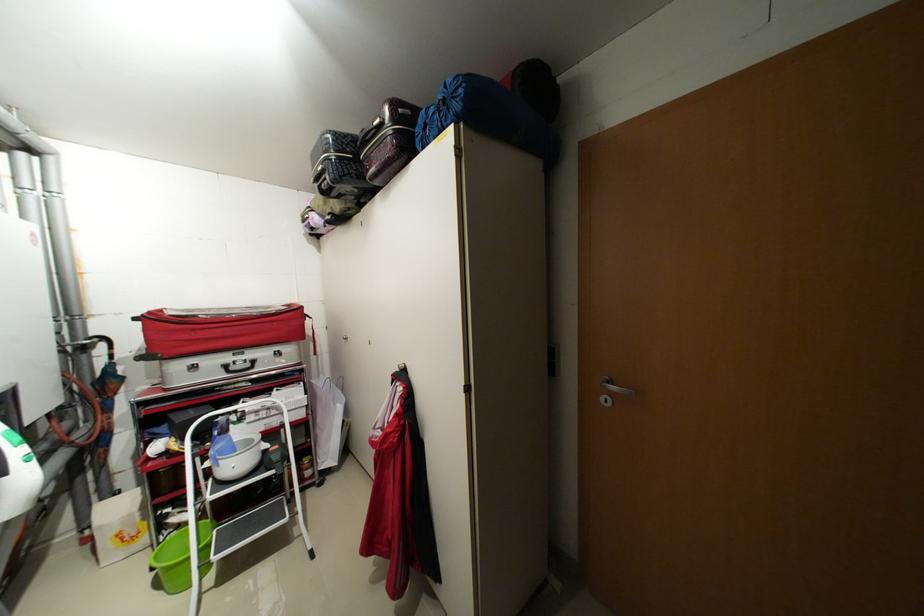
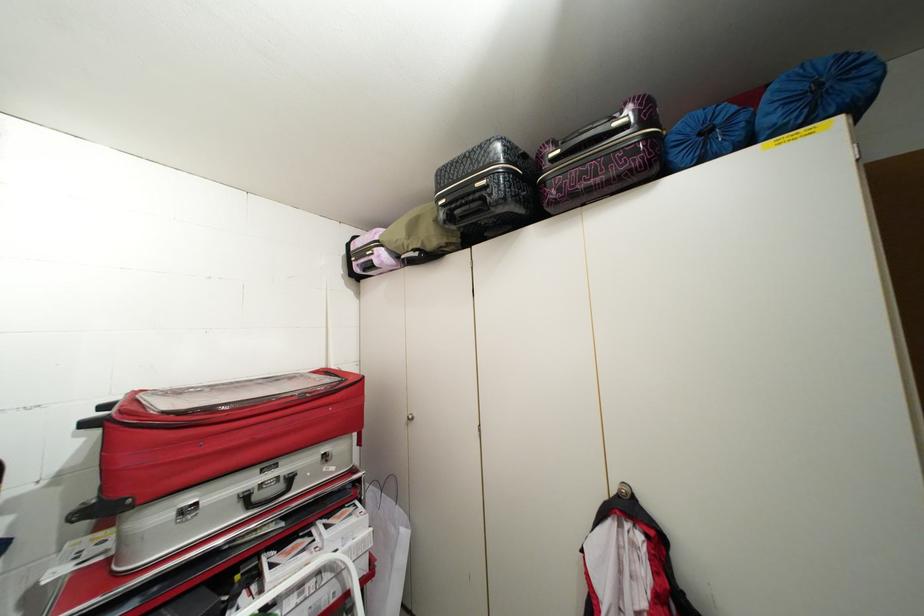
Question: The first image is from the beginning of the video and the second image is from the end. How did the camera likely rotate when shooting the video?

Choices:
 (A) Left
 (B) Right
 (C) Up
 (D) Down

Answer: (C)